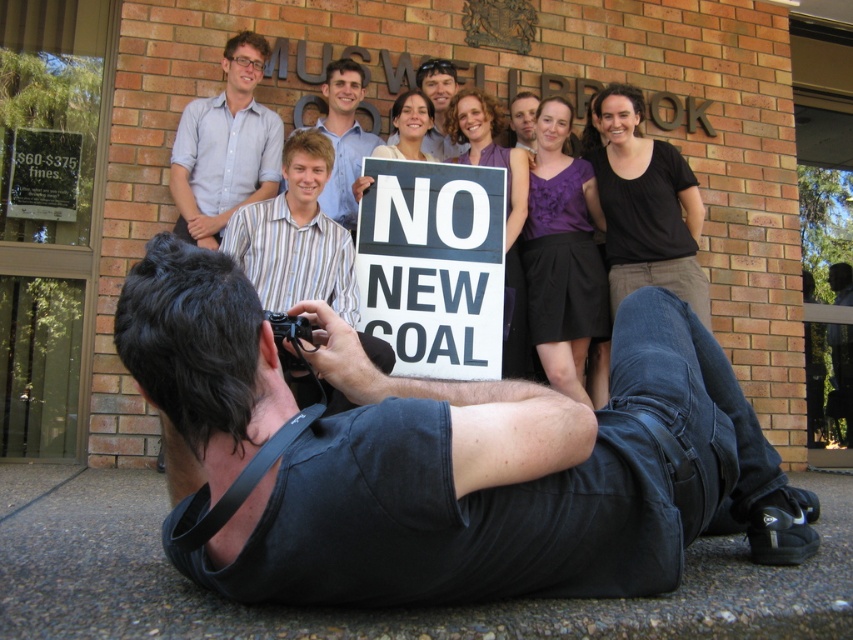
You are a photographer trying to capture the striped cotton shirt at center and the striped shirt at center in your frame. Which one is on the left side?

The striped cotton shirt at center is positioned on the left side of striped shirt at center.